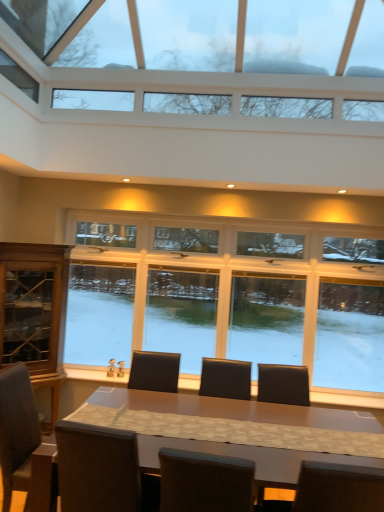
Question: Considering the relative sizes of clear glass windows at upper center, which is the 1th window from top to bottom, and dark brown leather armchair at center in the image provided, is clear glass windows at upper center, which is the 1th window from top to bottom, shorter than dark brown leather armchair at center?

Choices:
 (A) yes
 (B) no

Answer: (B)

Question: Does clear glass windows at upper center, which is the 1th window from top to bottom, have a greater width compared to dark brown leather armchair at center?

Choices:
 (A) no
 (B) yes

Answer: (B)

Question: From the image's perspective, is clear glass windows at upper center, which is the 1th window from top to bottom, on dark brown leather armchair at center?

Choices:
 (A) no
 (B) yes

Answer: (B)

Question: Could you tell me if clear glass windows at upper center, marked as the 2th window in a back-to-front arrangement, is turned towards dark brown leather armchair at center?

Choices:
 (A) yes
 (B) no

Answer: (B)

Question: Does clear glass windows at upper center, marked as the 2th window in a back-to-front arrangement, have a greater height compared to dark brown leather armchair at center?

Choices:
 (A) no
 (B) yes

Answer: (B)

Question: From the image's perspective, is clear glass windows at center, the 1th window from the bottom, positioned above or below matte brown table at center?

Choices:
 (A) below
 (B) above

Answer: (B)

Question: Considering the relative positions of clear glass windows at center, the second window from the top, and matte brown table at center in the image provided, is clear glass windows at center, the second window from the top, to the left or to the right of matte brown table at center?

Choices:
 (A) left
 (B) right

Answer: (B)

Question: Is point (109, 239) positioned closer to the camera than point (157, 461)?

Choices:
 (A) closer
 (B) farther

Answer: (B)

Question: Relative to matte brown table at center, is clear glass windows at center, the second window from the top, in front or behind?

Choices:
 (A) behind
 (B) front

Answer: (A)

Question: Considering the positions of point (167, 309) and point (263, 380), is point (167, 309) closer or farther from the camera than point (263, 380)?

Choices:
 (A) closer
 (B) farther

Answer: (B)

Question: From a real-world perspective, is clear glass windows at center, marked as the 2th window in a front-to-back arrangement, physically located above or below dark brown leather armchair at center?

Choices:
 (A) below
 (B) above

Answer: (B)

Question: From the image's perspective, is clear glass windows at center, the 1th window from the bottom, above or below dark brown leather armchair at center?

Choices:
 (A) above
 (B) below

Answer: (A)

Question: Visually, is clear glass windows at center, the 1th window from the bottom, positioned to the left or to the right of dark brown leather armchair at center?

Choices:
 (A) right
 (B) left

Answer: (B)

Question: Considering the positions of point (276, 366) and point (31, 440), is point (276, 366) closer or farther from the camera than point (31, 440)?

Choices:
 (A) closer
 (B) farther

Answer: (B)

Question: Based on their sizes in the image, would you say dark brown leather armchair at center is bigger or smaller than dark brown leather chair at lower left?

Choices:
 (A) small
 (B) big

Answer: (A)